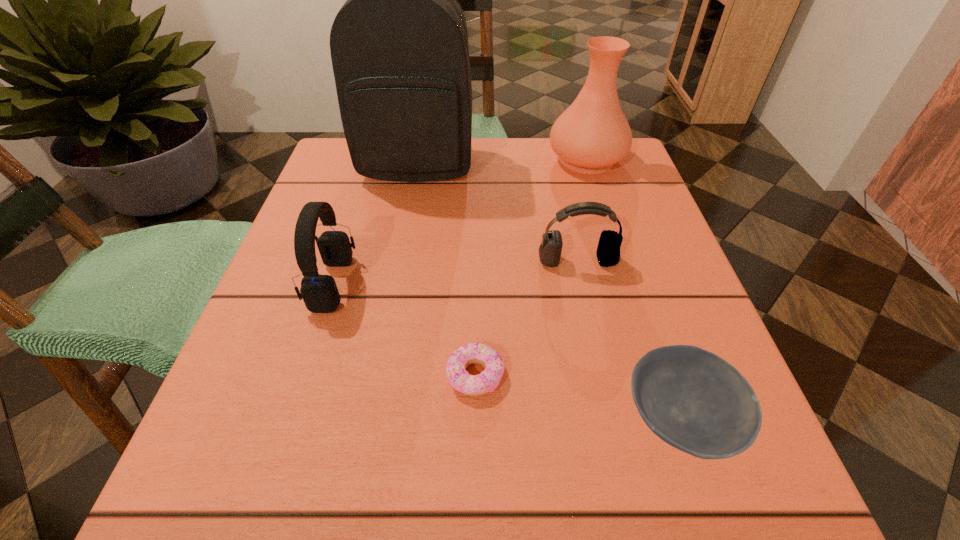
Locate an element on the screen. backpack is located at coordinates (399, 47).

In order to click on the fifth shortest object in this screenshot , I will do `click(592, 134)`.

Identify the location of the fourth shortest object. Image resolution: width=960 pixels, height=540 pixels. (320, 294).

What are the coordinates of `the left headset` in the screenshot? It's located at (320, 294).

The height and width of the screenshot is (540, 960). What are the coordinates of `the right headset` in the screenshot? It's located at (608, 251).

The width and height of the screenshot is (960, 540). I want to click on the third shortest object, so click(x=608, y=251).

This screenshot has height=540, width=960. I want to click on bowl, so click(692, 399).

In order to click on the shortest object in this screenshot , I will do [x=488, y=380].

The width and height of the screenshot is (960, 540). What are the coordinates of `blank space located on the front-facing side of the tallest object` in the screenshot? It's located at (409, 208).

The width and height of the screenshot is (960, 540). I want to click on vacant area situated 0.240m on the left of the vase, so click(x=444, y=159).